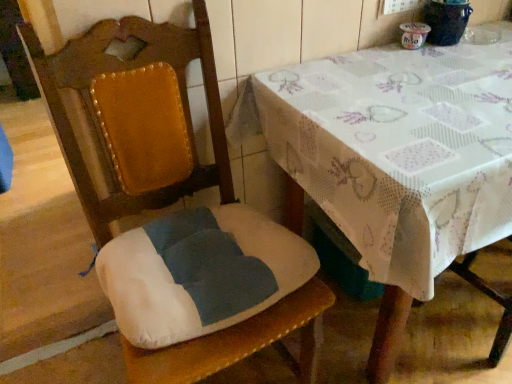
Question: In terms of width, does white printed tablecloth at upper right look wider or thinner when compared to velvet cushioned chair at center?

Choices:
 (A) thin
 (B) wide

Answer: (B)

Question: Which is correct: white printed tablecloth at upper right is inside velvet cushioned chair at center, or outside of it?

Choices:
 (A) outside
 (B) inside

Answer: (A)

Question: Does point [458, 92] appear closer or farther from the camera than point [198, 342]?

Choices:
 (A) farther
 (B) closer

Answer: (A)

Question: Looking at their shapes, would you say velvet cushioned chair at center is wider or thinner than white printed tablecloth at upper right?

Choices:
 (A) wide
 (B) thin

Answer: (B)

Question: Would you say velvet cushioned chair at center is to the left or to the right of white printed tablecloth at upper right in the picture?

Choices:
 (A) right
 (B) left

Answer: (B)

Question: Is velvet cushioned chair at center in front of or behind white printed tablecloth at upper right in the image?

Choices:
 (A) behind
 (B) front

Answer: (B)

Question: From a real-world perspective, is velvet cushioned chair at center above or below white printed tablecloth at upper right?

Choices:
 (A) above
 (B) below

Answer: (A)